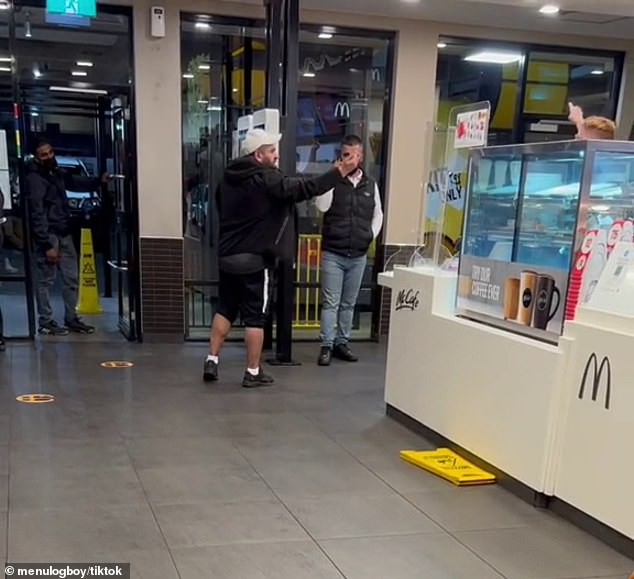
Locate an element on the screen. The image size is (634, 579). wet floor signs is located at coordinates (440, 463), (84, 295).